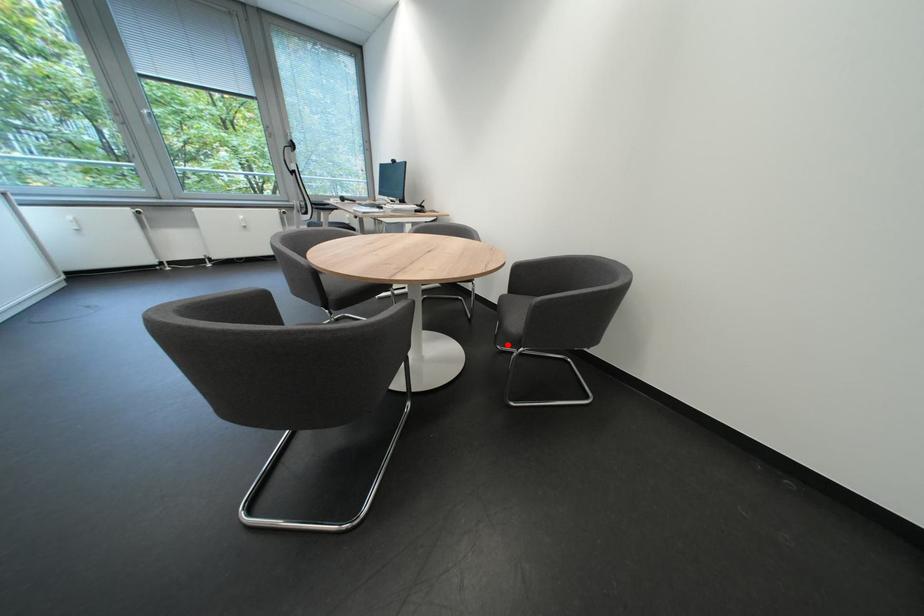
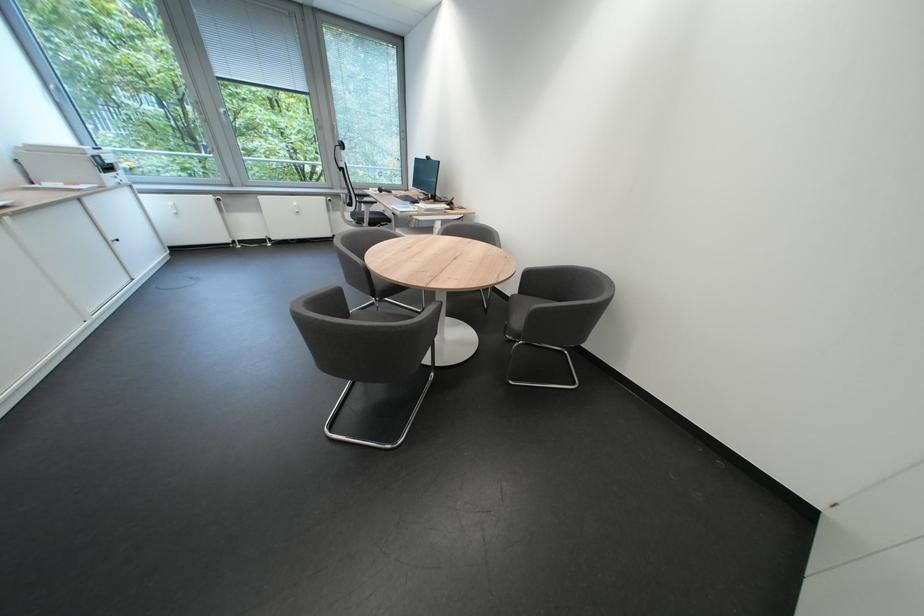
Question: I am providing you with two images of the same scene from different viewpoints. In image1, a red point is highlighted. Considering the same 3D point in image2, which of the following is correct?

Choices:
 (A) It is closer
 (B) It is farther

Answer: (A)